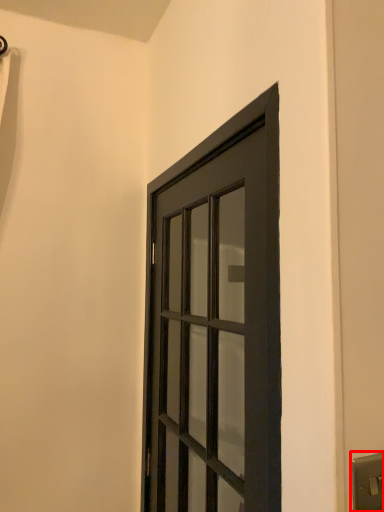
Question: From the image's perspective, what is the correct spatial relationship of light switch (annotated by the red box) in relation to door?

Choices:
 (A) above
 (B) below

Answer: (B)